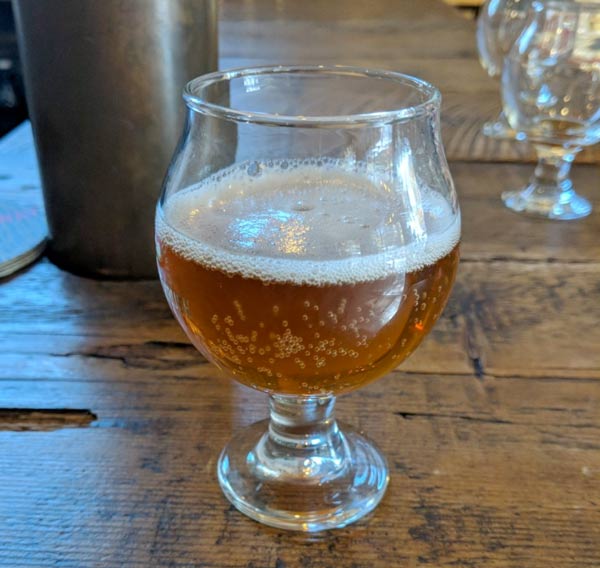
This screenshot has height=568, width=600. I want to click on base of glass, so click(329, 495), click(555, 197).